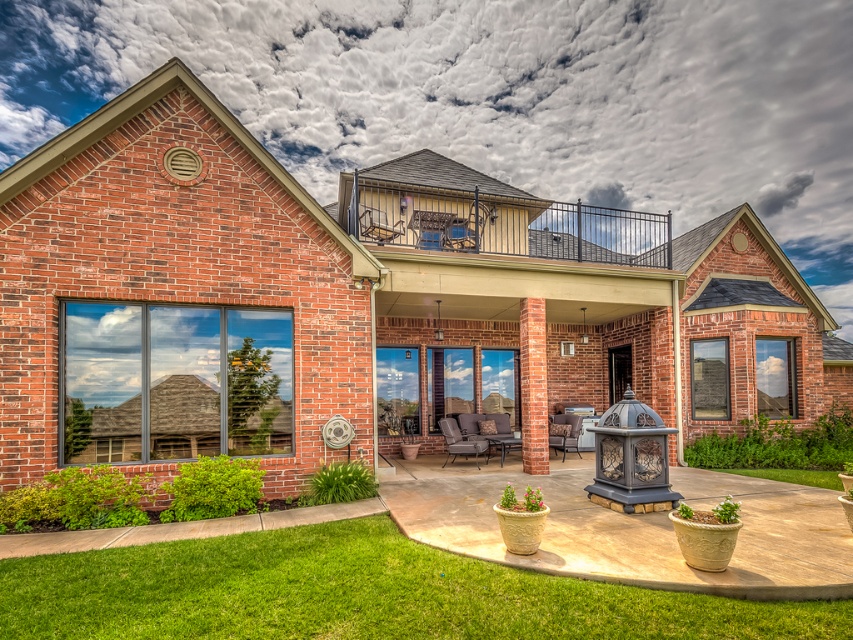
Between green grass at lower left and metallic lantern at center, which one has less height?

With less height is green grass at lower left.

Between green grass at lower left and metallic lantern at center, which one appears on the left side from the viewer's perspective?

From the viewer's perspective, green grass at lower left appears more on the left side.

Is point (190, 580) more distant than point (657, 420)?

That is False.

At what (x,y) coordinates should I click in order to perform the action: click on green grass at lower left. Please return your answer as a coordinate pair (x, y). The image size is (853, 640). Looking at the image, I should click on (358, 595).